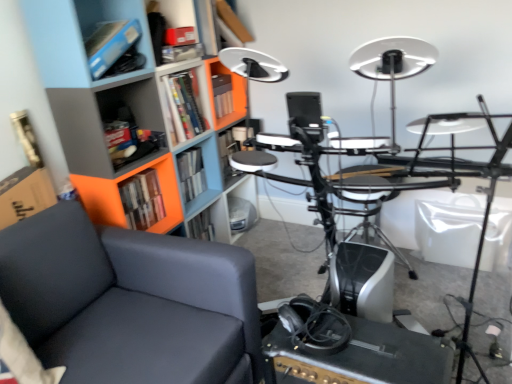
This screenshot has width=512, height=384. Describe the element at coordinates (347, 305) in the screenshot. I see `black plastic computer desk at center` at that location.

Describe the element at coordinates (119, 112) in the screenshot. I see `orange plastic bookcase at left` at that location.

Identify the location of matte plastic shelf at center, marked as the 3th shelf in a front-to-back arrangement. (230, 149).

Measure the distance between matte plastic shelf at upper center, which is the first shelf in top-to-bottom order, and camera.

matte plastic shelf at upper center, which is the first shelf in top-to-bottom order, and camera are 5.83 feet apart from each other.

Where is `hardcover book at center, positioned as the 1th book in back-to-front order`? Image resolution: width=512 pixels, height=384 pixels. hardcover book at center, positioned as the 1th book in back-to-front order is located at coordinates (191, 173).

Where is `metallic gray shelf at upper left, the third shelf when ordered from top to bottom`? The height and width of the screenshot is (384, 512). metallic gray shelf at upper left, the third shelf when ordered from top to bottom is located at coordinates (132, 105).

From the image's perspective, is matte plastic shelf at lower center, which is counted as the first shelf, starting from the back, on matte plastic shelf at center, positioned as the 3th shelf in bottom-to-top order?

Actually, matte plastic shelf at lower center, which is counted as the first shelf, starting from the back, appears below matte plastic shelf at center, positioned as the 3th shelf in bottom-to-top order, in the image.

Is matte plastic shelf at lower center, which is counted as the first shelf, starting from the back, located outside matte plastic shelf at center, positioned as the 3th shelf in bottom-to-top order?

matte plastic shelf at lower center, which is counted as the first shelf, starting from the back, lies outside matte plastic shelf at center, positioned as the 3th shelf in bottom-to-top order,'s area.

Considering the sizes of objects matte plastic shelf at lower center, which is counted as the first shelf, starting from the back, and matte plastic shelf at center, marked as the 3th shelf in a front-to-back arrangement, in the image provided, who is smaller, matte plastic shelf at lower center, which is counted as the first shelf, starting from the back, or matte plastic shelf at center, marked as the 3th shelf in a front-to-back arrangement,?

matte plastic shelf at center, marked as the 3th shelf in a front-to-back arrangement.

Would you say hardcover book at center, marked as the first book in a front-to-back arrangement, contains orange plastic bookcase at left?

No, orange plastic bookcase at left is not a part of hardcover book at center, marked as the first book in a front-to-back arrangement.

Is hardcover book at center, marked as the first book in a front-to-back arrangement, thinner than orange plastic bookcase at left?

Correct, the width of hardcover book at center, marked as the first book in a front-to-back arrangement, is less than that of orange plastic bookcase at left.

How many degrees apart are the facing directions of hardcover book at center, marked as the first book in a front-to-back arrangement, and orange plastic bookcase at left?

The facing directions of hardcover book at center, marked as the first book in a front-to-back arrangement, and orange plastic bookcase at left are 1.63 degrees apart.

This screenshot has height=384, width=512. What are the coordinates of `bookcase on the right of hardcover book at center, marked as the first book in a front-to-back arrangement` in the screenshot? It's located at coord(119,112).

What's the angular difference between black plastic computer desk at center and orange plastic bookcase at left's facing directions?

90.2 degrees.

From a real-world perspective, which object rests below the other?

black plastic computer desk at center, from a real-world perspective.

Can you confirm if black plastic computer desk at center is positioned to the right of orange plastic bookcase at left?

Yes, black plastic computer desk at center is to the right of orange plastic bookcase at left.

Is matte plastic shelf at upper center, the third shelf in the back-to-front sequence, taller than black matte amplifier at lower center?

No.

Looking at this image, is matte plastic shelf at upper center, marked as the fourth shelf in a bottom-to-top arrangement, not near black matte amplifier at lower center?

Indeed, matte plastic shelf at upper center, marked as the fourth shelf in a bottom-to-top arrangement, is not near black matte amplifier at lower center.

Where is `table below the matte plastic shelf at upper center, which is the first shelf in top-to-bottom order (from the image's perspective)`? This screenshot has height=384, width=512. table below the matte plastic shelf at upper center, which is the first shelf in top-to-bottom order (from the image's perspective) is located at coordinates (361, 356).

Is matte plastic shelf at upper center, marked as the fourth shelf in a bottom-to-top arrangement, not within black matte amplifier at lower center?

Absolutely, matte plastic shelf at upper center, marked as the fourth shelf in a bottom-to-top arrangement, is external to black matte amplifier at lower center.

Is black plastic computer desk at center a part of black matte amplifier at lower center?

No.

Is point (345, 350) positioned before point (483, 231)?

Yes, point (345, 350) is closer to viewer.

From the image's perspective, which object appears higher, black matte amplifier at lower center or black plastic computer desk at center?

black plastic computer desk at center is shown above in the image.

Is black matte amplifier at lower center bigger or smaller than black plastic computer desk at center?

Clearly, black matte amplifier at lower center is smaller in size than black plastic computer desk at center.

Is black plastic computer desk at center oriented towards matte plastic shelf at center, which appears as the second shelf when viewed from the top?

No, black plastic computer desk at center does not turn towards matte plastic shelf at center, which appears as the second shelf when viewed from the top.

From a real-world perspective, between black plastic computer desk at center and matte plastic shelf at center, marked as the 3th shelf in a front-to-back arrangement, who is vertically higher?

black plastic computer desk at center is physically above.

From the image's perspective, would you say black plastic computer desk at center is shown under matte plastic shelf at center, positioned as the 3th shelf in bottom-to-top order?

Yes, from the image's perspective, black plastic computer desk at center is below matte plastic shelf at center, positioned as the 3th shelf in bottom-to-top order.

Considering the relative positions of black plastic computer desk at center and matte plastic shelf at center, marked as the 3th shelf in a front-to-back arrangement, in the image provided, is black plastic computer desk at center behind matte plastic shelf at center, marked as the 3th shelf in a front-to-back arrangement,?

No.

From the picture: Which is more to the right, orange plastic bookcase at left or black plastic computer desk at center?

black plastic computer desk at center.

Looking at this image, can we say orange plastic bookcase at left lies outside black plastic computer desk at center?

Yes, orange plastic bookcase at left is outside of black plastic computer desk at center.

Considering the relative sizes of orange plastic bookcase at left and black plastic computer desk at center in the image provided, is orange plastic bookcase at left wider than black plastic computer desk at center?

No, orange plastic bookcase at left is not wider than black plastic computer desk at center.

Find the location of a particular element. Image resolution: width=512 pixels, height=384 pixels. shelf behind the matte plastic shelf at center, which appears as the second shelf when viewed from the top is located at coordinates (242, 207).

Where is `bookcase that is in front of the hardcover book at center, marked as the first book in a front-to-back arrangement`? The image size is (512, 384). bookcase that is in front of the hardcover book at center, marked as the first book in a front-to-back arrangement is located at coordinates (119, 112).

Which object lies nearer to the anchor point matte plastic shelf at lower center, which is counted as the first shelf, starting from the back, metallic gray shelf at upper left, marked as the 2th shelf in a bottom-to-top arrangement, or orange plastic bookcase at left?

orange plastic bookcase at left is positioned closer to the anchor matte plastic shelf at lower center, which is counted as the first shelf, starting from the back.

Which object lies nearer to the anchor point metallic gray shelf at upper left, the 1th shelf positioned from the front, matte black chair at left or black plastic computer desk at center?

matte black chair at left lies closer to metallic gray shelf at upper left, the 1th shelf positioned from the front, than the other object.

Which object lies nearer to the anchor point black matte amplifier at lower center, orange plastic bookcase at left or black plastic computer desk at center?

black plastic computer desk at center is positioned closer to the anchor black matte amplifier at lower center.

Which object lies nearer to the anchor point metallic gray shelf at upper left, the third shelf when ordered from top to bottom, matte plastic shelf at center, which appears as the second shelf when viewed from the top, or black matte amplifier at lower center?

Based on the image, matte plastic shelf at center, which appears as the second shelf when viewed from the top, appears to be nearer to metallic gray shelf at upper left, the third shelf when ordered from top to bottom.

Which object lies nearer to the anchor point matte plastic shelf at lower center, the 1th shelf from the bottom, matte plastic shelf at upper center, the third shelf in the back-to-front sequence, or black matte amplifier at lower center?

Among the two, matte plastic shelf at upper center, the third shelf in the back-to-front sequence, is located nearer to matte plastic shelf at lower center, the 1th shelf from the bottom.

Based on their spatial positions, is black plastic computer desk at center or hardcover book at center, marked as the first book in a front-to-back arrangement, further from matte plastic shelf at upper center, marked as the second shelf in a front-to-back arrangement?

black plastic computer desk at center is positioned further to the anchor matte plastic shelf at upper center, marked as the second shelf in a front-to-back arrangement.

Based on their spatial positions, is black plastic computer desk at center or matte black chair at left further from orange plastic bookcase at left?

black plastic computer desk at center is positioned further to the anchor orange plastic bookcase at left.

When comparing their distances from matte plastic shelf at lower center, which is the fourth shelf in top-to-bottom order, does matte plastic shelf at upper center, marked as the fourth shelf in a bottom-to-top arrangement, or hardcover book at center, marked as the 2th book in a front-to-back arrangement, seem closer?

hardcover book at center, marked as the 2th book in a front-to-back arrangement, is closer to matte plastic shelf at lower center, which is the fourth shelf in top-to-bottom order.

In order to click on bookcase positioned between matte black chair at left and hardcover book at center, the second book from the back, from near to far in this screenshot , I will do `click(119, 112)`.

Identify the location of bookcase between black matte amplifier at lower center and hardcover book at center, the second book from the back, from front to back. The image size is (512, 384). (119, 112).

Find the location of a particular element. bookcase between black plastic computer desk at center and matte plastic shelf at center, acting as the 2th shelf starting from the back, along the z-axis is located at coordinates pos(119,112).

Find the location of a particular element. The image size is (512, 384). chair between orange plastic bookcase at left and black matte amplifier at lower center from top to bottom is located at coordinates (130, 302).